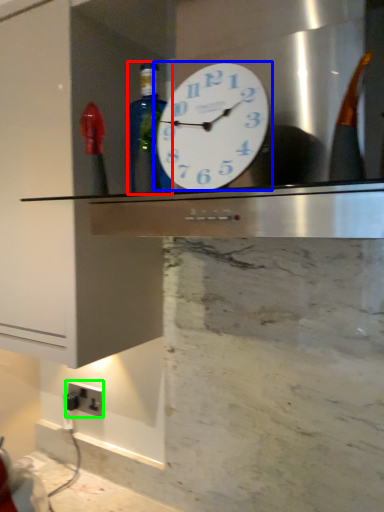
Question: Which object is the farthest from bottle (highlighted by a red box)? Choose among these: wall clock (highlighted by a blue box) or electric outlet (highlighted by a green box).

Choices:
 (A) wall clock
 (B) electric outlet

Answer: (B)